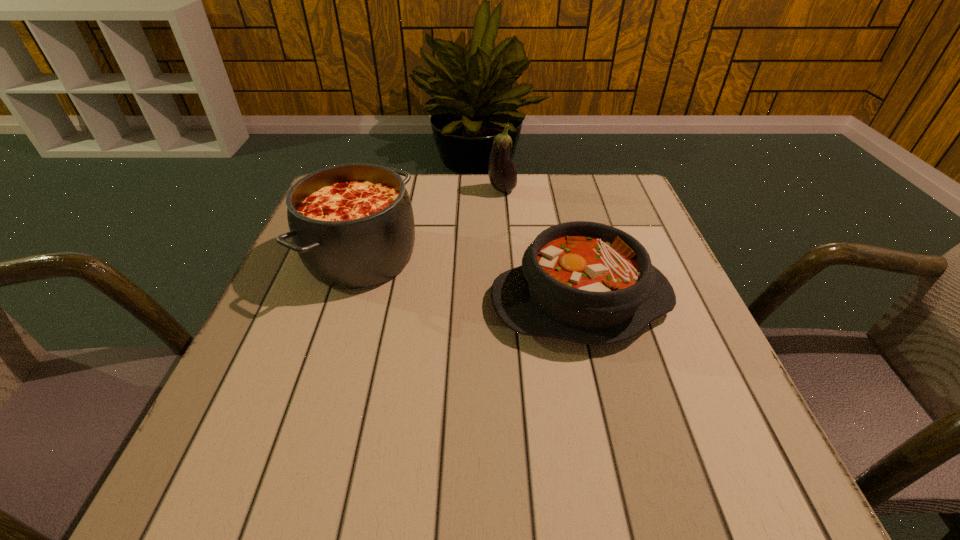
Identify the location of free spot between the leftmost object and the farthest object. The image size is (960, 540). (432, 224).

This screenshot has width=960, height=540. What are the coordinates of `free space between the left casserole and the right casserole` in the screenshot? It's located at (471, 279).

I want to click on free spot between the eggplant and the taller casserole, so click(x=432, y=224).

I want to click on empty location between the left casserole and the eggplant, so click(x=432, y=224).

Find the location of a particular element. The image size is (960, 540). vacant space in between the leftmost object and the farthest object is located at coordinates (432, 224).

Where is `empty space that is in between the right casserole and the left casserole`? This screenshot has width=960, height=540. empty space that is in between the right casserole and the left casserole is located at coordinates (471, 279).

I want to click on free area in between the eggplant and the leftmost object, so click(432, 224).

Locate an element on the screen. This screenshot has height=540, width=960. free space between the shortest object and the leftmost object is located at coordinates (471, 279).

Where is `the second closest object to the shortest object`? The width and height of the screenshot is (960, 540). the second closest object to the shortest object is located at coordinates [502, 174].

Point out which object is positioned as the nearest to the left casserole. Please provide its 2D coordinates. Your answer should be formatted as a tuple, i.e. [(x, y)], where the tuple contains the x and y coordinates of a point satisfying the conditions above.

[(590, 283)]